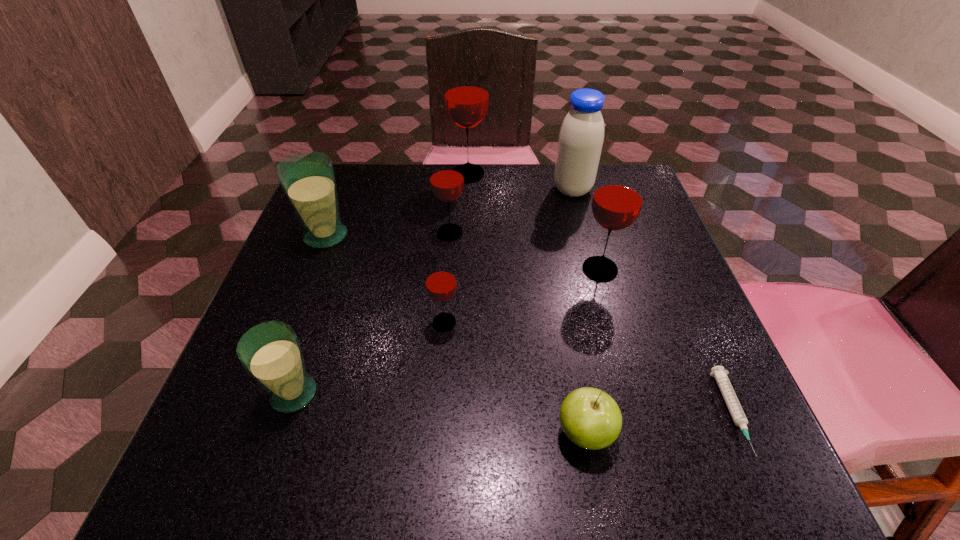
At what (x,y) coordinates should I click in order to perform the action: click on the tallest glass. Please return your answer as a coordinate pair (x, y). Looking at the image, I should click on (466, 90).

Image resolution: width=960 pixels, height=540 pixels. I want to click on the farthest glass, so click(466, 90).

The image size is (960, 540). I want to click on blue soya milk, so click(x=581, y=136).

Image resolution: width=960 pixels, height=540 pixels. What are the coordinates of `the rightmost glass` in the screenshot? It's located at (618, 198).

The image size is (960, 540). In order to click on the rightmost red glass in this screenshot , I will do (x=618, y=198).

This screenshot has width=960, height=540. I want to click on the second farthest red glass, so click(x=446, y=173).

Identify the location of the bigger blue glass. Image resolution: width=960 pixels, height=540 pixels. (307, 178).

The image size is (960, 540). Identify the location of the smaller blue glass. (270, 352).

At what (x,y) coordinates should I click in order to perform the action: click on the nearer blue glass. Please return your answer as a coordinate pair (x, y). The image size is (960, 540). Looking at the image, I should click on [270, 352].

This screenshot has height=540, width=960. In order to click on the smallest red glass in this screenshot , I will do `click(440, 281)`.